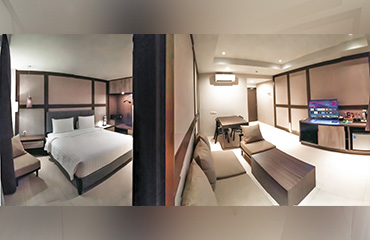
The height and width of the screenshot is (240, 370). In order to click on television in this screenshot , I will do click(x=327, y=109).